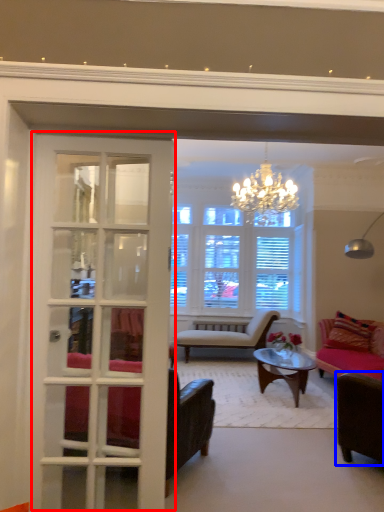
Question: Among these objects, which one is farthest to the camera, door (highlighted by a red box) or chair (highlighted by a blue box)?

Choices:
 (A) door
 (B) chair

Answer: (B)